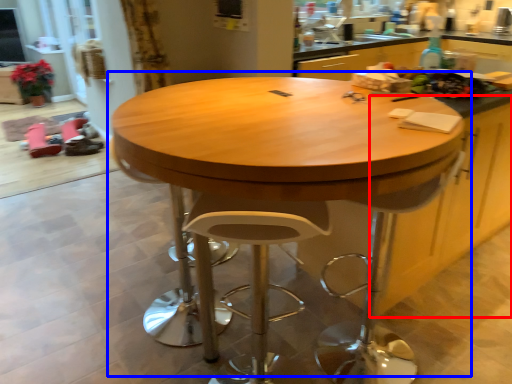
Question: Which of the following is the farthest to the observer, cabinetry (highlighted by a red box) or table (highlighted by a blue box)?

Choices:
 (A) cabinetry
 (B) table

Answer: (A)